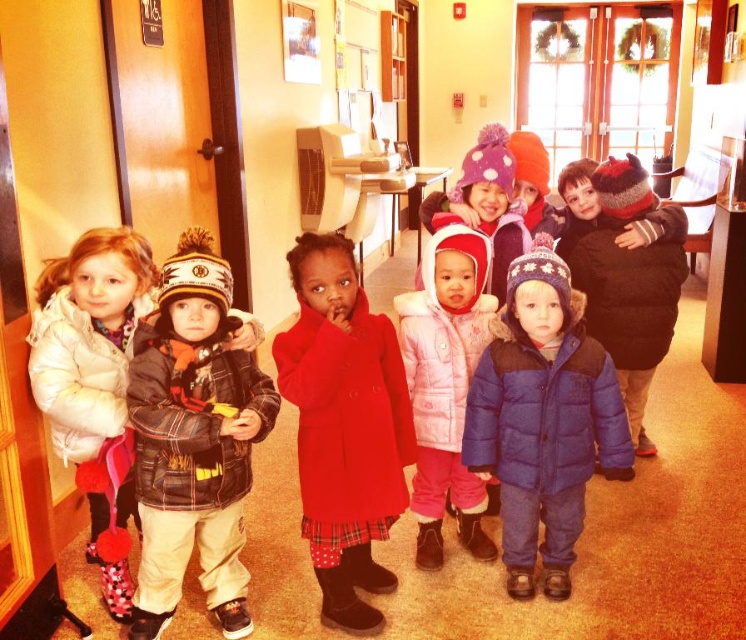
From the picture: You are a photographer trying to take a group photo of the children. You want to ensure that the blue puffy coat at center and the pink fleece coat at center are both visible in the frame. Based on their positions, which coat should you focus on first to ensure both are in the shot?

The blue puffy coat at center is to the right of the pink fleece coat at center, so you should focus on the pink fleece coat at center first to ensure both are in the frame.

You are a photographer standing in the hallway and want to take a photo of the blue puffy coat at center. Where should you position yourself to capture it in the frame?

You should position yourself facing the blue puffy coat at center located at point [542,420] to capture it in the frame.

You are standing in the hallway and need to reach a point that is exactly at coordinate point (545, 572). If your current position is 5 feet away from the camera, will you have to move forward or backward to reach that point?

The distance of point (545, 572) from camera is 7.59 feet. Since you are currently 5 feet away from the camera, you need to move forward an additional 2.59 feet to reach the point.